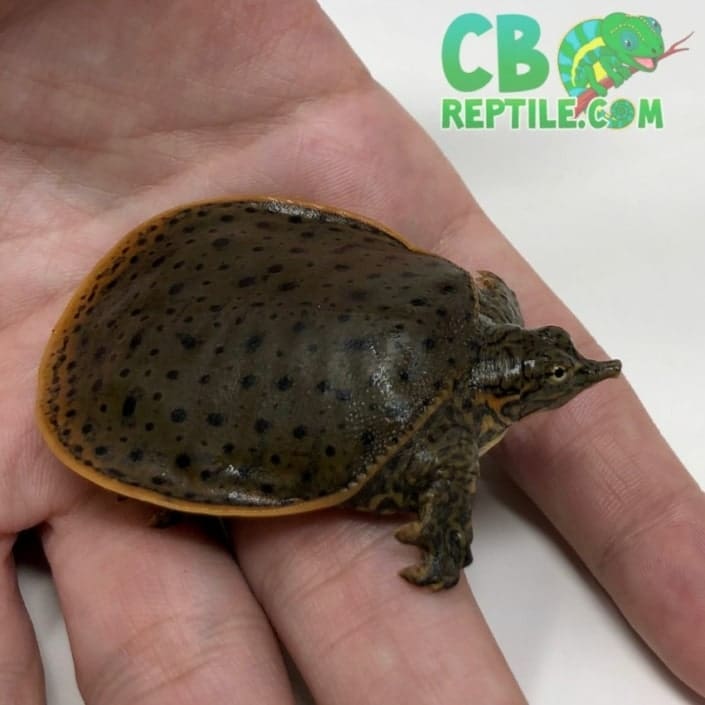
This screenshot has height=705, width=705. I want to click on table, so click(627, 242).